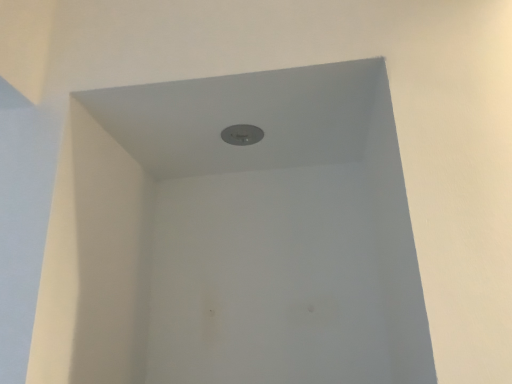
Identify the location of matte gray hole at center. (242, 134).

Measure the distance between matte gray hole at center and camera.

A distance of 33.86 inches exists between matte gray hole at center and camera.

The width and height of the screenshot is (512, 384). Describe the element at coordinates (242, 134) in the screenshot. I see `matte gray hole at center` at that location.

This screenshot has height=384, width=512. What are the coordinates of `matte gray hole at center` in the screenshot? It's located at (242, 134).